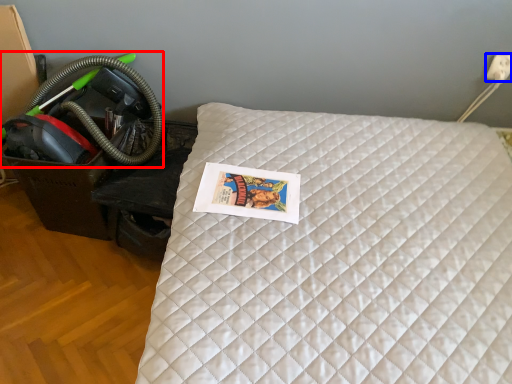
Question: Which of the following is the farthest to the observer, garden hose (highlighted by a red box) or electric outlet (highlighted by a blue box)?

Choices:
 (A) garden hose
 (B) electric outlet

Answer: (B)